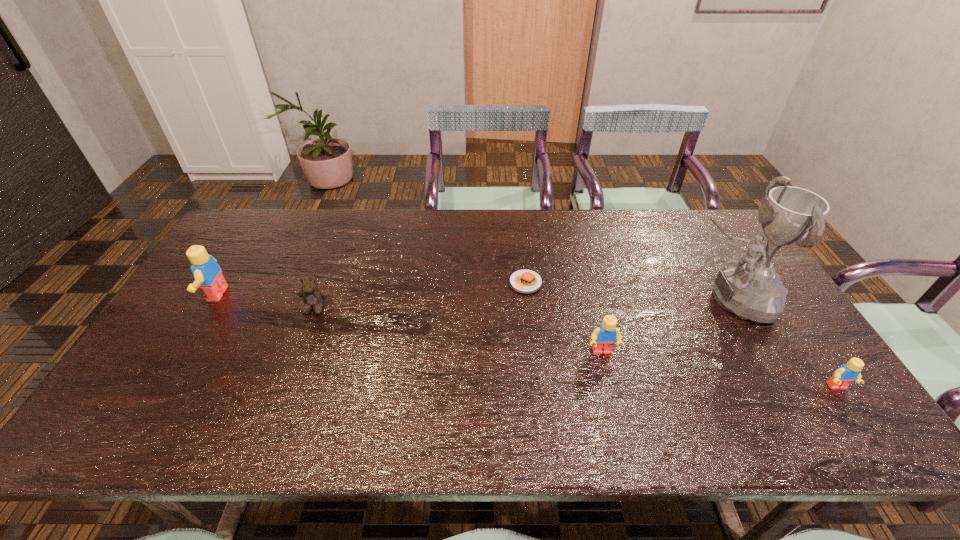
Please point a location where one more Lego can be added evenly. Please provide its 2D coordinates. Your answer should be formatted as a tuple, i.e. [(x, y)], where the tuple contains the x and y coordinates of a point satisfying the conditions above.

[(396, 321)]